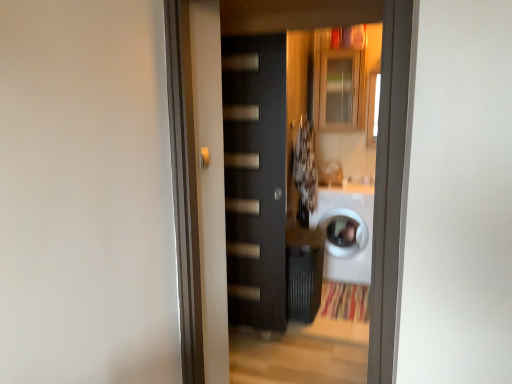
Question: Can you confirm if matte black door handle at center is smaller than white glossy washing machine at center?

Choices:
 (A) no
 (B) yes

Answer: (B)

Question: Is matte black door handle at center completely or partially outside of white glossy washing machine at center?

Choices:
 (A) no
 (B) yes

Answer: (B)

Question: Is the position of matte black door handle at center more distant than that of white glossy washing machine at center?

Choices:
 (A) no
 (B) yes

Answer: (A)

Question: From a real-world perspective, does matte black door handle at center stand above white glossy washing machine at center?

Choices:
 (A) no
 (B) yes

Answer: (B)

Question: Is matte black door handle at center wider than white glossy washing machine at center?

Choices:
 (A) yes
 (B) no

Answer: (B)

Question: Considering the positions of matte black door at center and fluffy white laundry at center in the image, is matte black door at center wider or thinner than fluffy white laundry at center?

Choices:
 (A) wide
 (B) thin

Answer: (B)

Question: From the image's perspective, is matte black door at center above or below fluffy white laundry at center?

Choices:
 (A) below
 (B) above

Answer: (A)

Question: From a real-world perspective, relative to fluffy white laundry at center, is matte black door at center vertically above or below?

Choices:
 (A) above
 (B) below

Answer: (B)

Question: In terms of height, does matte black door at center look taller or shorter compared to fluffy white laundry at center?

Choices:
 (A) short
 (B) tall

Answer: (B)

Question: Is fluffy white laundry at center taller or shorter than matte black door handle at center?

Choices:
 (A) tall
 (B) short

Answer: (A)

Question: Is point (309, 148) positioned closer to the camera than point (200, 155)?

Choices:
 (A) closer
 (B) farther

Answer: (B)

Question: Is fluffy white laundry at center bigger or smaller than matte black door handle at center?

Choices:
 (A) small
 (B) big

Answer: (B)

Question: Visually, is fluffy white laundry at center positioned to the left or to the right of matte black door handle at center?

Choices:
 (A) right
 (B) left

Answer: (A)

Question: From the image's perspective, is matte black door at center positioned above or below matte glass cabinet at upper center?

Choices:
 (A) below
 (B) above

Answer: (A)

Question: Is point (266, 279) positioned closer to the camera than point (343, 125)?

Choices:
 (A) farther
 (B) closer

Answer: (B)